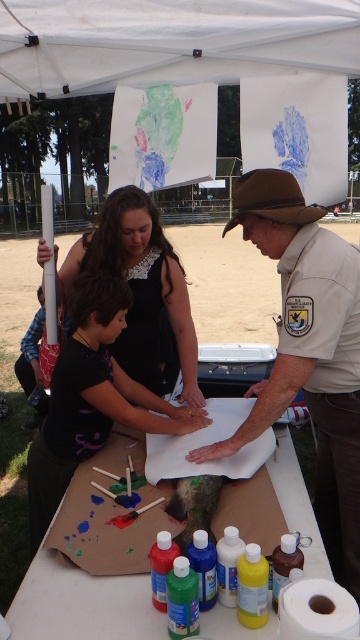
Question: Where is white fabric canopy at upper center located in relation to brown uniform at center in the image?

Choices:
 (A) below
 (B) above

Answer: (B)

Question: Estimate the real-world distances between objects in this image. Which object is farther from the brown uniform at center?

Choices:
 (A) matte black shirt at center
 (B) white fabric canopy at upper center
 (C) matte cardboard table at center
 (D) matte black dress at center

Answer: (B)

Question: Can you confirm if matte black shirt at center is positioned to the left of matte cardboard table at center?

Choices:
 (A) no
 (B) yes

Answer: (B)

Question: Estimate the real-world distances between objects in this image. Which object is farther from the brown uniform at center?

Choices:
 (A) white matte toilet paper at lower right
 (B) white fabric canopy at upper center

Answer: (B)

Question: Which of these objects is positioned farthest from the matte black shirt at center?

Choices:
 (A) matte black dress at center
 (B) matte cardboard table at center

Answer: (B)

Question: Is white fabric canopy at upper center smaller than brown uniform at center?

Choices:
 (A) no
 (B) yes

Answer: (B)